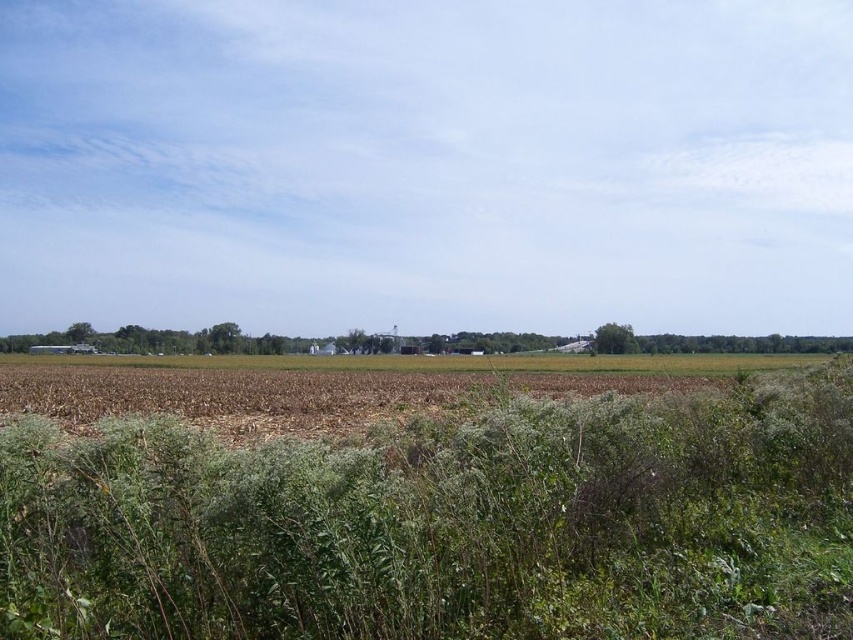
You are standing at the point with coordinates point (112, 534) and want to walk towards the point with coordinates point (532, 368). Will you have to go through the dense vegetation in the foreground?

Point (112, 534) is in front of point (532, 368), so you will have to go through the dense vegetation in the foreground to reach it.

You are a farmer checking the growth of your crops. You notice two areas of green grass at center and green grassy vegetation at center. Which area has shorter plants?

The green grassy vegetation at center is shorter than the green grass at center, so the area with green grassy vegetation at center has shorter plants.

You are standing at the point labeled as point (445,524) in the image. What type of terrain are you currently standing on?

You are standing on green grassy vegetation at center.